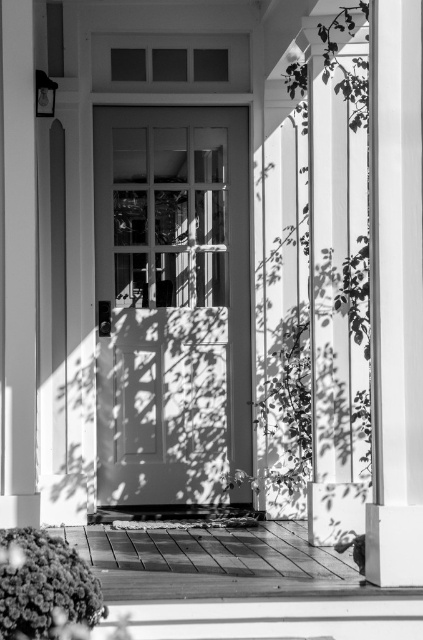
Does matte gray door at center have a lesser width compared to smooth white pillar at right?

In fact, matte gray door at center might be wider than smooth white pillar at right.

Is point (142, 353) more distant than point (326, 316)?

Yes, it is behind point (326, 316).

Who is more distant from viewer, (153, 387) or (313, 257)?

Positioned behind is point (153, 387).

Where is `matte gray door at center`? matte gray door at center is located at coordinates (172, 300).

The image size is (423, 640). Describe the element at coordinates (172, 300) in the screenshot. I see `matte gray door at center` at that location.

Does matte gray door at center appear on the right side of smooth white column at right?

No, matte gray door at center is not to the right of smooth white column at right.

The width and height of the screenshot is (423, 640). What are the coordinates of `matte gray door at center` in the screenshot? It's located at (172, 300).

The width and height of the screenshot is (423, 640). What are the coordinates of `matte gray door at center` in the screenshot? It's located at (172, 300).

Between smooth white column at right and smooth white pillar at right, which one is positioned lower?

smooth white column at right is lower down.

Looking at this image, does smooth white column at right appear over smooth white pillar at right?

No, smooth white column at right is not above smooth white pillar at right.

Which is behind, point (381, 584) or point (318, 48)?

Point (318, 48)

At what (x,y) coordinates should I click in order to perform the action: click on smooth white column at right. Please return your answer as a coordinate pair (x, y). The width and height of the screenshot is (423, 640). Looking at the image, I should click on (395, 292).